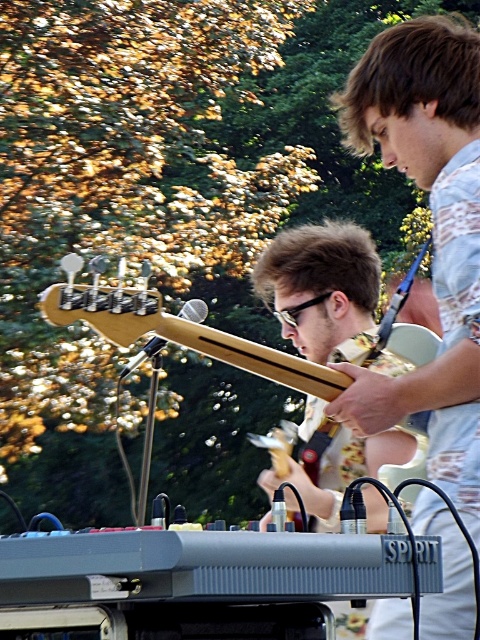
Measure the distance from matte wood guitar at center to light wood electric guitar at center.

matte wood guitar at center and light wood electric guitar at center are 9.41 inches apart from each other.

Find the location of a particular element. The width and height of the screenshot is (480, 640). matte wood guitar at center is located at coordinates (322, 289).

Which is behind, point (294, 340) or point (160, 340)?

Positioned behind is point (294, 340).

Find the location of a particular element. matte wood guitar at center is located at coordinates (322, 289).